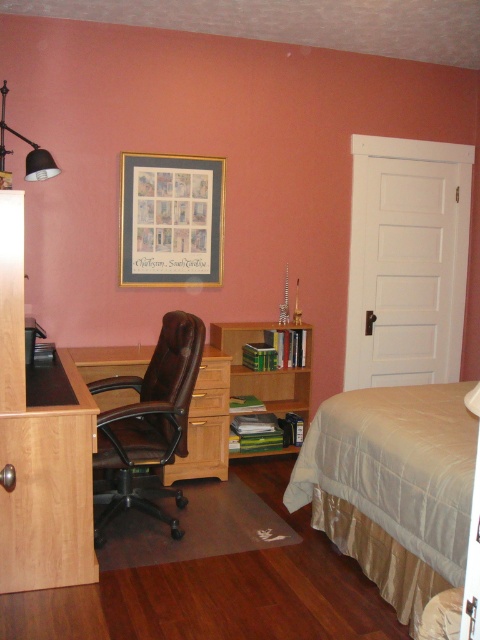
Between brown leather swivel chair at center and brown wood drawer at center, which one is positioned lower?

brown leather swivel chair at center is lower down.

Measure the distance between brown leather swivel chair at center and brown wood drawer at center.

brown leather swivel chair at center is 22.56 inches away from brown wood drawer at center.

Is point (165, 360) positioned before point (201, 388)?

Yes, it is.

This screenshot has width=480, height=640. In order to click on brown leather swivel chair at center in this screenshot , I will do `click(148, 420)`.

How distant is brown wood computer desk at center from wooden drawer at center?

brown wood computer desk at center is 18.38 inches away from wooden drawer at center.

Is brown wood computer desk at center positioned before wooden drawer at center?

Yes, brown wood computer desk at center is closer to the viewer.

What do you see at coordinates (203, 451) in the screenshot? I see `brown wood computer desk at center` at bounding box center [203, 451].

Locate an element on the screen. brown wood computer desk at center is located at coordinates (203, 451).

Does matte black lamp at upper left lie in front of brown wood drawer at center?

Yes.

Between point (0, 120) and point (216, 380), which one is positioned in front?

Point (0, 120) is more forward.

This screenshot has height=640, width=480. Describe the element at coordinates (28, 150) in the screenshot. I see `matte black lamp at upper left` at that location.

The width and height of the screenshot is (480, 640). I want to click on matte black lamp at upper left, so click(x=28, y=150).